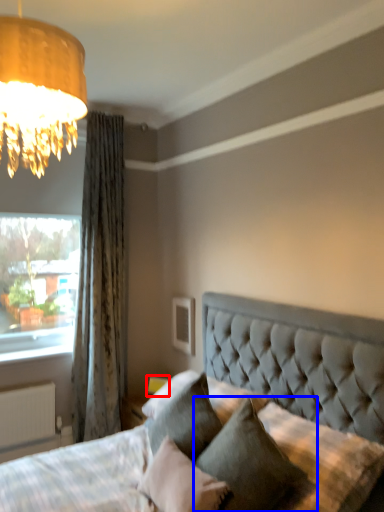
Question: Which point is closer to the camera, table lamp (highlighted by a red box) or pillow (highlighted by a blue box)?

Choices:
 (A) table lamp
 (B) pillow

Answer: (B)